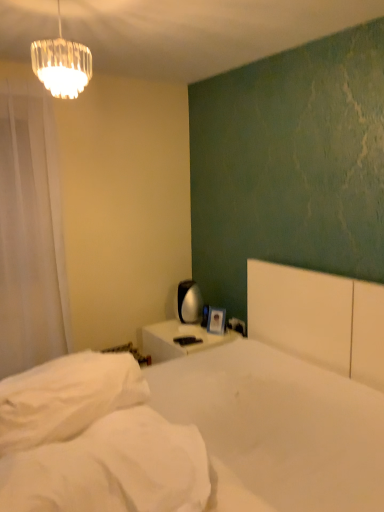
Question: From the image's perspective, is clear glass chandelier at upper left under white sheer curtain at left?

Choices:
 (A) yes
 (B) no

Answer: (B)

Question: Does clear glass chandelier at upper left touch white sheer curtain at left?

Choices:
 (A) yes
 (B) no

Answer: (B)

Question: Is the position of clear glass chandelier at upper left more distant than that of white sheer curtain at left?

Choices:
 (A) no
 (B) yes

Answer: (A)

Question: Can you confirm if clear glass chandelier at upper left is smaller than white sheer curtain at left?

Choices:
 (A) no
 (B) yes

Answer: (B)

Question: Is clear glass chandelier at upper left bigger than white sheer curtain at left?

Choices:
 (A) no
 (B) yes

Answer: (A)

Question: From a real-world perspective, is white sheer curtain at left physically located above or below white plastic electric outlet at upper right?

Choices:
 (A) above
 (B) below

Answer: (A)

Question: Is white sheer curtain at left inside or outside of white plastic electric outlet at upper right?

Choices:
 (A) inside
 (B) outside

Answer: (B)

Question: Looking at the image, does white sheer curtain at left seem bigger or smaller compared to white plastic electric outlet at upper right?

Choices:
 (A) small
 (B) big

Answer: (B)

Question: Is point (43, 360) closer or farther from the camera than point (241, 330)?

Choices:
 (A) closer
 (B) farther

Answer: (A)

Question: Is white plastic electric outlet at upper right to the left or to the right of white matte bed at center in the image?

Choices:
 (A) left
 (B) right

Answer: (B)

Question: Does point (231, 317) appear closer or farther from the camera than point (337, 423)?

Choices:
 (A) closer
 (B) farther

Answer: (B)

Question: Do you think white plastic electric outlet at upper right is within white matte bed at center, or outside of it?

Choices:
 (A) inside
 (B) outside

Answer: (B)

Question: From a real-world perspective, is white plastic electric outlet at upper right physically located above or below white matte bed at center?

Choices:
 (A) above
 (B) below

Answer: (B)

Question: Is white matte bed at center wider or thinner than white soft pillow at lower left?

Choices:
 (A) wide
 (B) thin

Answer: (A)

Question: In the image, is white matte bed at center on the left side or the right side of white soft pillow at lower left?

Choices:
 (A) left
 (B) right

Answer: (B)